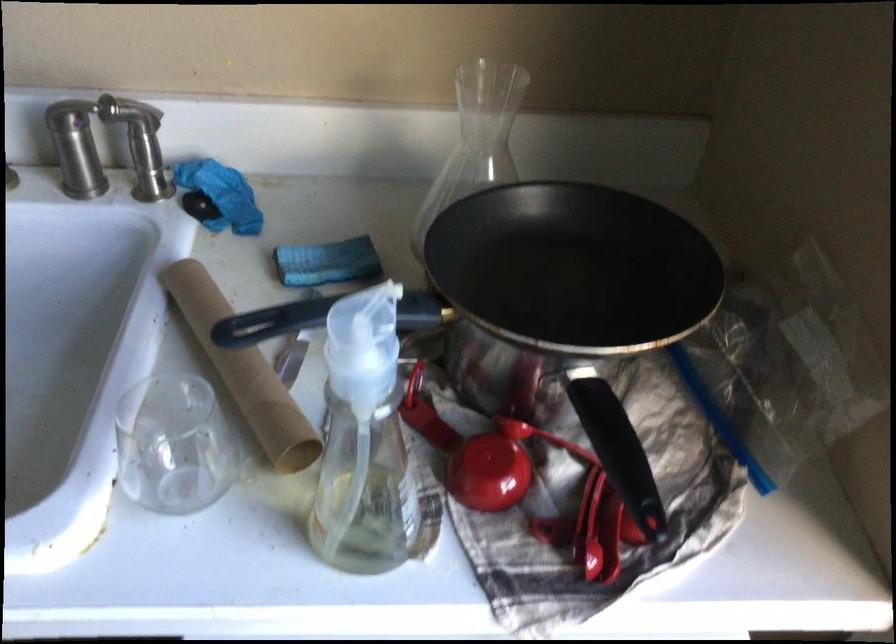
The width and height of the screenshot is (896, 644). What are the coordinates of `red measuring cup` in the screenshot? It's located at click(x=512, y=469).